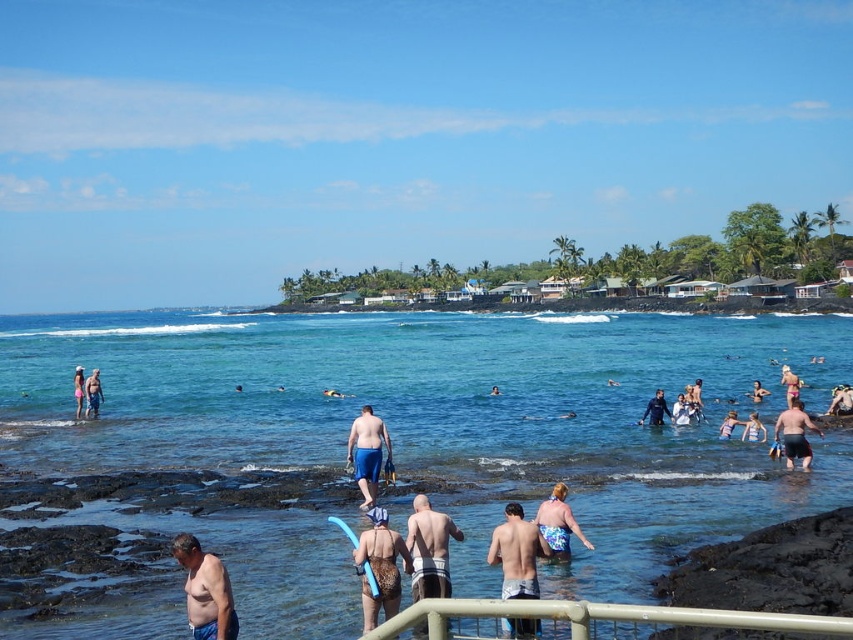
Question: Which is farther from the pink fabric bikini at center?

Choices:
 (A) white metal railing at lower center
 (B) smooth skin man at center
 (C) light pink swimsuit at center

Answer: (A)

Question: Which point appears farthest from the camera in this image?

Choices:
 (A) (828, 408)
 (B) (370, 417)

Answer: (A)

Question: Is the position of blue fabric shorts at center more distant than that of light blue fabric swimsuit at center?

Choices:
 (A) no
 (B) yes

Answer: (A)

Question: Is the position of floral swimsuit at center less distant than that of smooth skin person at center?

Choices:
 (A) no
 (B) yes

Answer: (B)

Question: Based on their relative distances, which object is nearer to the light blue fabric swimsuit at center?

Choices:
 (A) black matte shorts at lower right
 (B) matte black swim trunks at center
 (C) blue fabric swimsuit at center

Answer: (C)

Question: Does smooth white shorts at center have a larger size compared to blue fabric swimsuit at center?

Choices:
 (A) no
 (B) yes

Answer: (A)